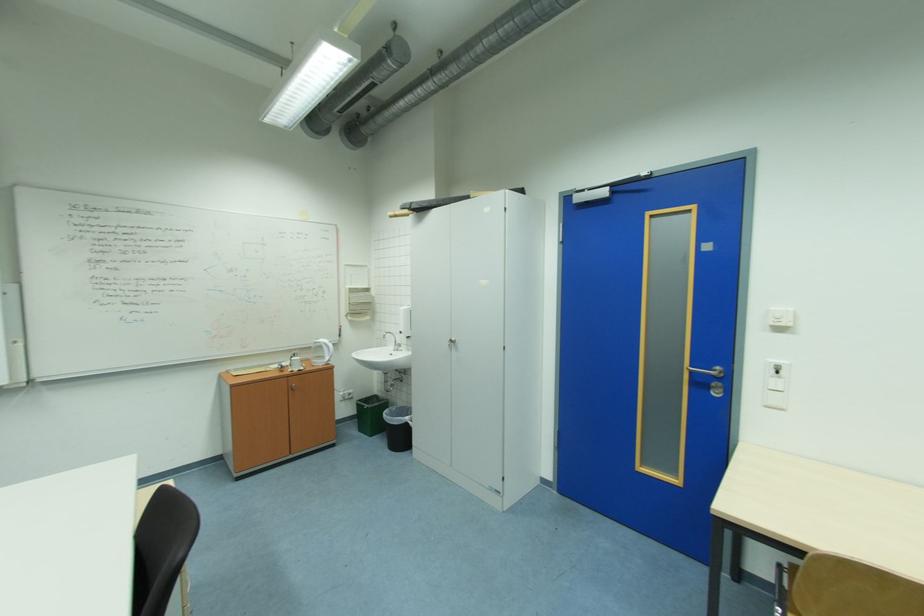
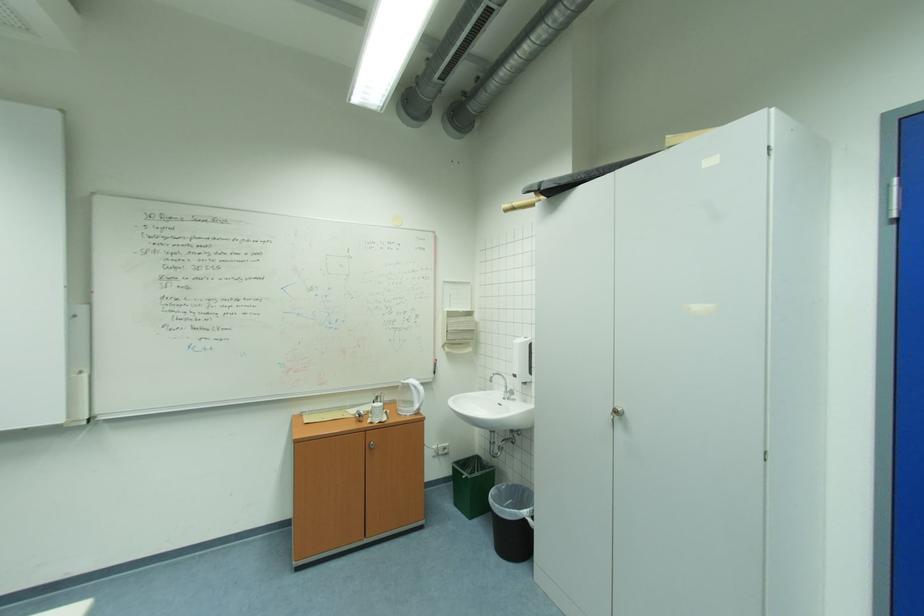
Locate, in the second image, the point that corresponds to [298,386] in the first image.

(375, 443)